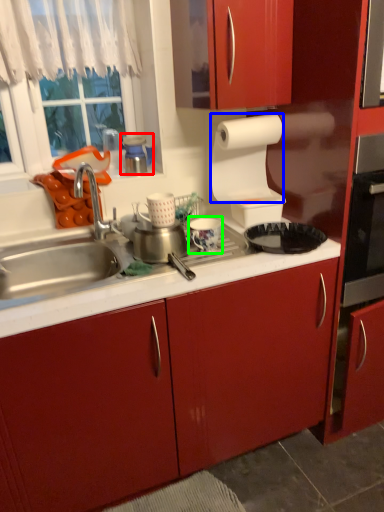
Question: Which is farther away from appliance (highlighted by a red box)? paper towel (highlighted by a blue box) or appliance (highlighted by a green box)?

Choices:
 (A) paper towel
 (B) appliance

Answer: (B)